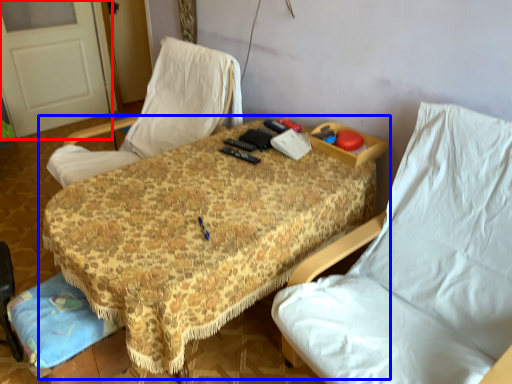
Question: Which of the following is the farthest to the observer, door (highlighted by a red box) or table (highlighted by a blue box)?

Choices:
 (A) door
 (B) table

Answer: (A)